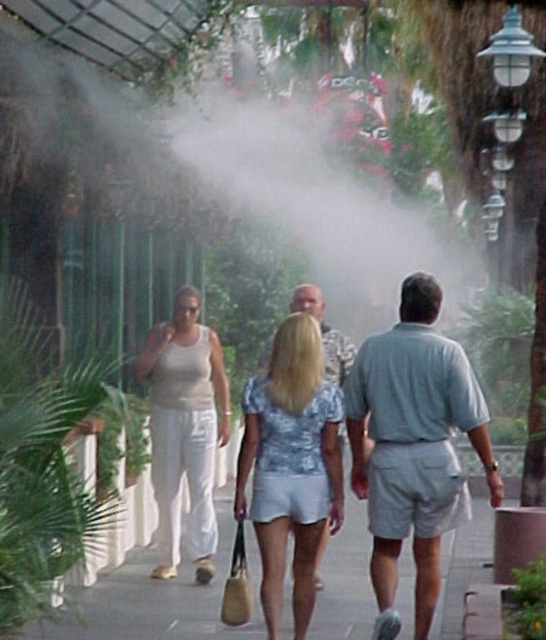
You are a photographer positioned to the side of the pathway. You want to capture a shot that includes both the green leafy palm tree at left and the light blue lace blouse at center. Based on their positions, will the palm tree appear in front of or behind the light blue lace blouse in the photo?

The green leafy palm tree at left is located above the light blue lace blouse at center, so in the photo, the palm tree will appear behind the light blue lace blouse since it is positioned higher up in the frame.

You are standing on the pathway and want to take a photo of the light blue lace blouse at center and the green leafy palm tree at left. Which object should you position closer to the left side of your camera frame?

The green leafy palm tree at left should be positioned closer to the left side of your camera frame since it is located to the left of the light blue lace blouse at center in the scene.